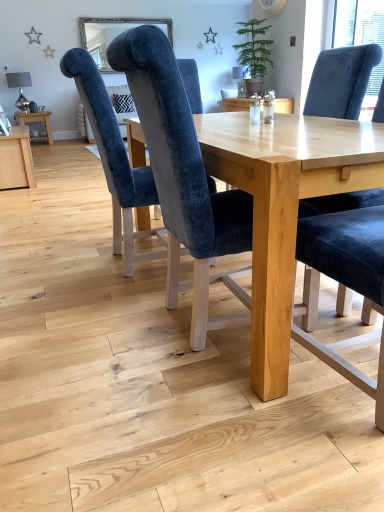
Where is `free space in front of velvet blue chair at center, acting as the 1th chair starting from the left`? The image size is (384, 512). free space in front of velvet blue chair at center, acting as the 1th chair starting from the left is located at coordinates (102, 303).